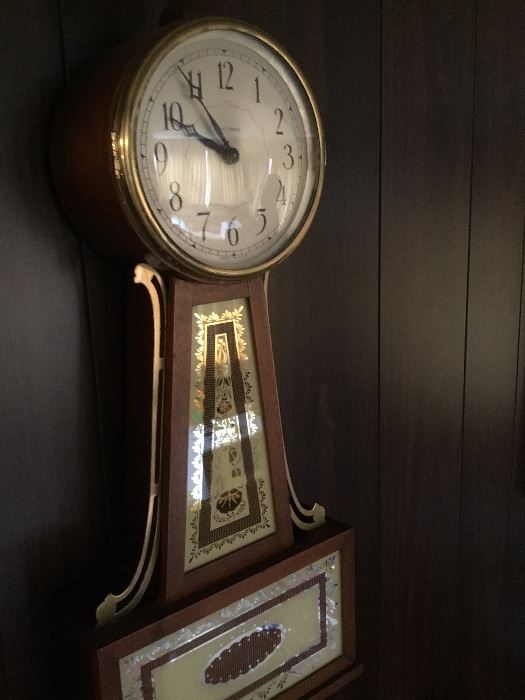
Image resolution: width=525 pixels, height=700 pixels. In order to click on small grandfater clock in this screenshot , I will do `click(270, 626)`.